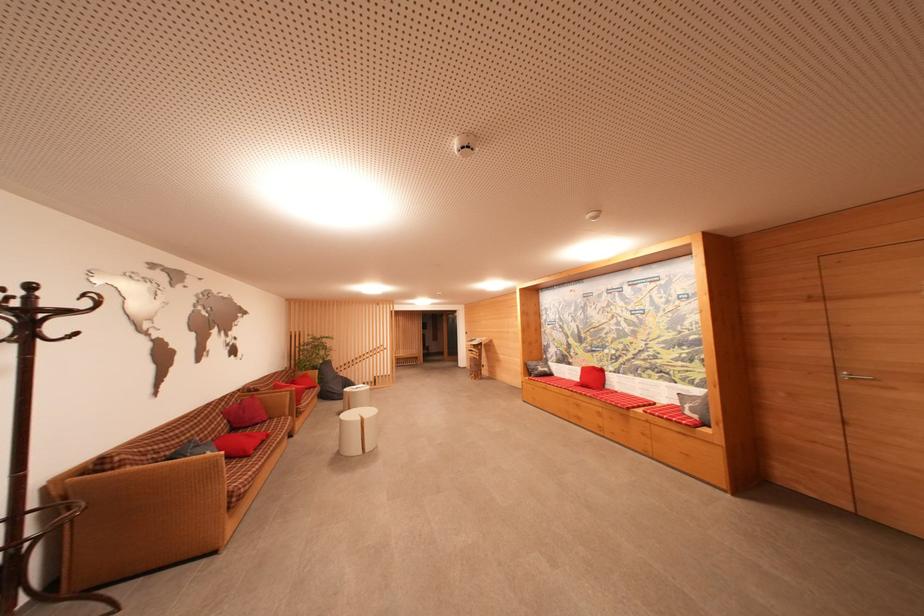
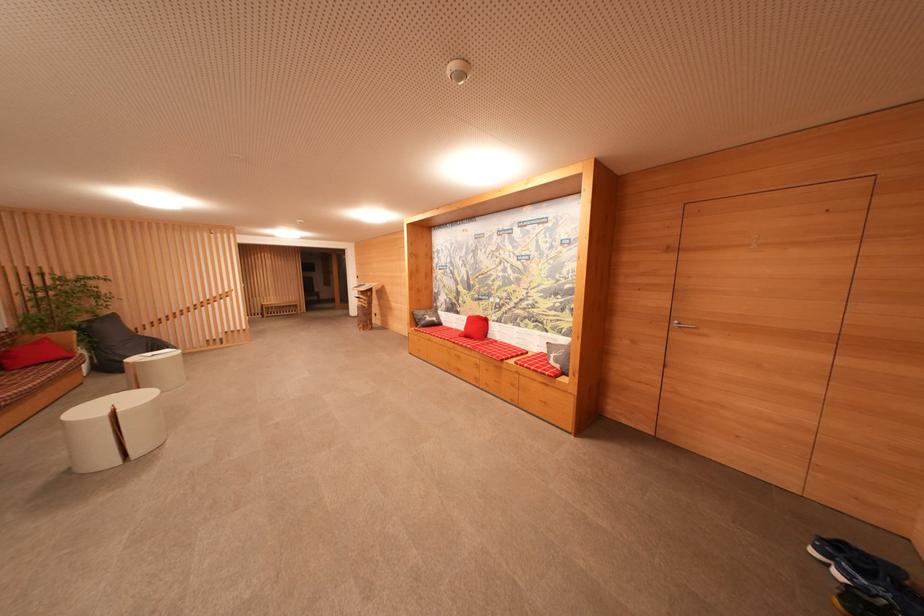
Locate, in the second image, the point that corresponds to (x=697, y=415) in the first image.

(560, 363)